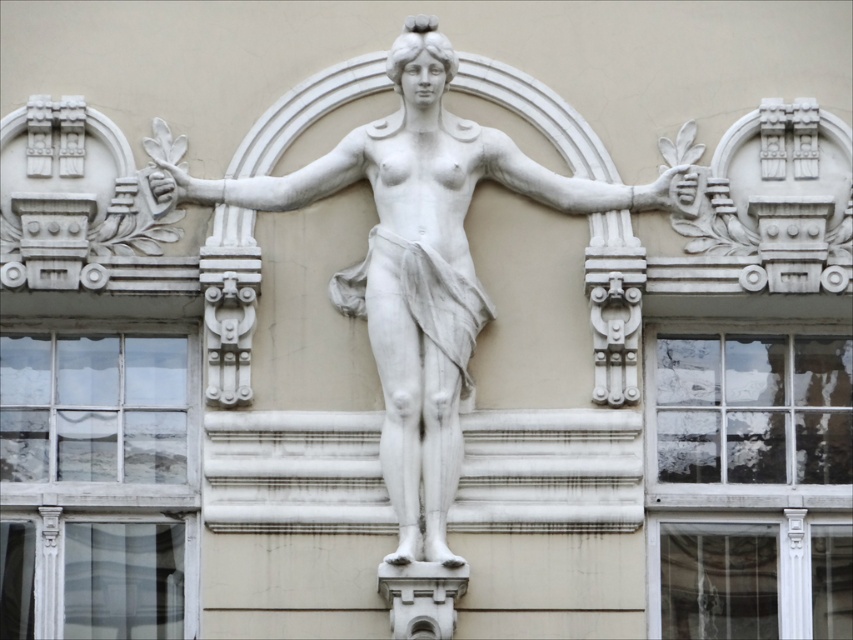
Between point (505, 186) and point (666, 177), which one is positioned behind?

Point (505, 186)

Does white stone arm at center have a lesser height compared to white stone hand at upper right?

No, white stone arm at center is not shorter than white stone hand at upper right.

Does point (585, 188) lie in front of point (677, 161)?

Yes, point (585, 188) is in front of point (677, 161).

Where is `white stone arm at center`? The height and width of the screenshot is (640, 853). white stone arm at center is located at coordinates (590, 186).

Who is higher up, white marble statue at center or white stone hand at upper right?

Positioned higher is white stone hand at upper right.

Between white marble statue at center and white stone hand at upper right, which one appears on the right side from the viewer's perspective?

white stone hand at upper right is more to the right.

Is point (648, 200) positioned before point (672, 202)?

No, it is behind (672, 202).

Locate an element on the screen. The width and height of the screenshot is (853, 640). white marble statue at center is located at coordinates (421, 264).

Is white marble statue at center further to the viewer compared to white marble hand at upper left?

No.

Which of these two, white marble statue at center or white marble hand at upper left, stands shorter?

white marble hand at upper left is shorter.

Measure the distance between white marble statue at center and camera.

white marble statue at center and camera are 80.84 meters apart from each other.

Find the location of a particular element. The width and height of the screenshot is (853, 640). white marble statue at center is located at coordinates (421, 264).